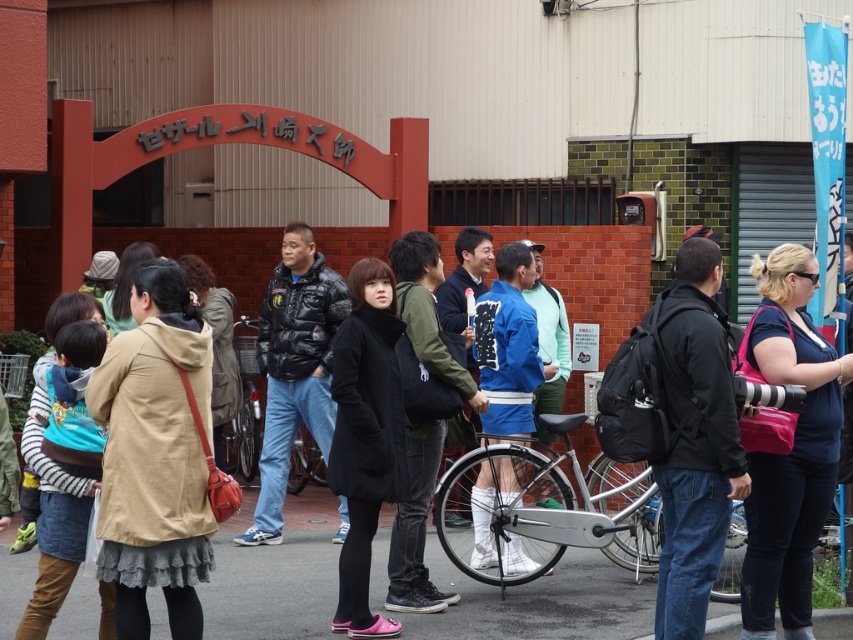
Based on the photo, does silver metallic bicycle at center appear on the left side of matte black bicycle at center?

Incorrect, silver metallic bicycle at center is not on the left side of matte black bicycle at center.

Is silver metallic bicycle at center positioned before matte black bicycle at center?

Yes.

Identify the location of silver metallic bicycle at center. (546, 509).

Is black puffy jacket at center above matte black bicycle at center?

Yes, black puffy jacket at center is above matte black bicycle at center.

Looking at this image, can you confirm if black puffy jacket at center is taller than matte black bicycle at center?

Yes, black puffy jacket at center is taller than matte black bicycle at center.

Is point (279, 458) positioned before point (257, 388)?

Yes, it is in front of point (257, 388).

Image resolution: width=853 pixels, height=640 pixels. Identify the location of black puffy jacket at center. (294, 369).

Based on the photo, does dark blue fabric shirt at center appear under blue fabric kimono at center?

Indeed, dark blue fabric shirt at center is positioned under blue fabric kimono at center.

Does point (811, 449) lie in front of point (531, 564)?

Yes, it is in front of point (531, 564).

The width and height of the screenshot is (853, 640). What are the coordinates of `dark blue fabric shirt at center` in the screenshot? It's located at (791, 445).